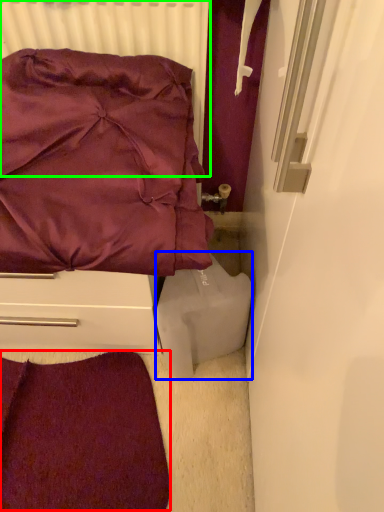
Question: Which is farther away from violet (highlighted by a red box)? wide (highlighted by a blue box) or radiator (highlighted by a green box)?

Choices:
 (A) wide
 (B) radiator

Answer: (B)